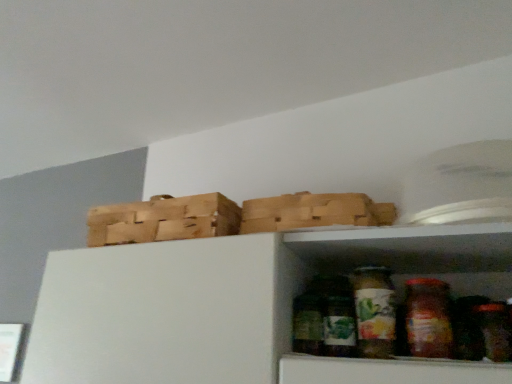
Question: Choose the correct answer: Is wooden crate at upper left inside translucent glass jar at center, positioned as the 2th glass jar in left-to-right order, or outside it?

Choices:
 (A) inside
 (B) outside

Answer: (B)

Question: Considering their positions, is wooden crate at upper left located in front of or behind translucent glass jar at center, which ranks as the first glass jar in right-to-left order?

Choices:
 (A) behind
 (B) front

Answer: (A)

Question: Estimate the real-world distances between objects in this image. Which object is closer to the green matte glass jar at lower center, the second glass jar in the right-to-left sequence?

Choices:
 (A) wooden crate at upper left
 (B) translucent glass jar at center, which ranks as the first glass jar in right-to-left order

Answer: (B)

Question: Based on their relative distances, which object is nearer to the wooden crate at upper left?

Choices:
 (A) translucent glass jar at center, which ranks as the first glass jar in right-to-left order
 (B) green matte glass jar at lower center, positioned as the 1th glass jar in left-to-right order

Answer: (B)